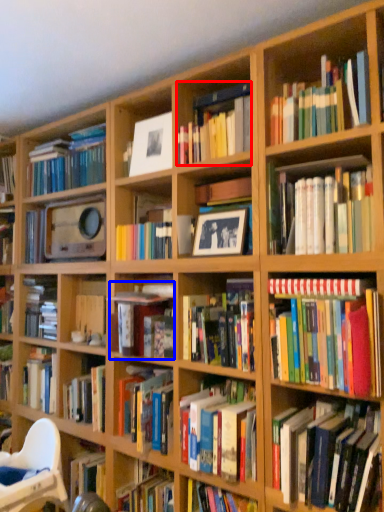
Question: Which object is further to the camera taking this photo, book (highlighted by a red box) or book (highlighted by a blue box)?

Choices:
 (A) book
 (B) book

Answer: (B)